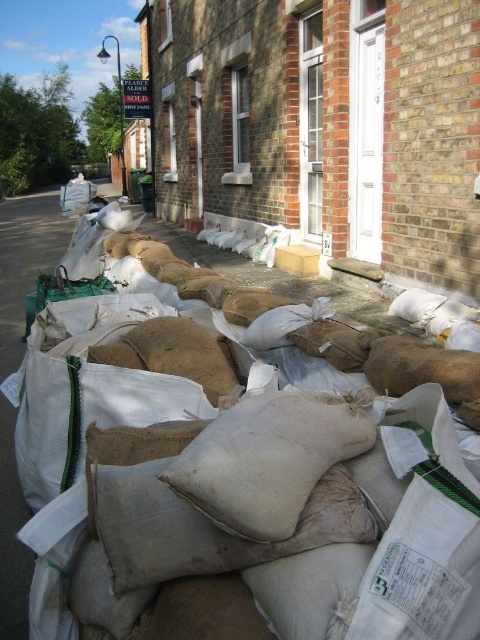
You are a delivery person trying to place a beige fabric pillow at center and a burlap sack at center onto a shelf. The shelf can only hold items that are not stacked. Can you place both items on the shelf?

The beige fabric pillow at center is positioned under burlap sack at center, so they are stacked. Therefore, you cannot place both items on the shelf since the shelf can only hold items that are not stacked.

You are a delivery person trying to navigate through the street scene. You see a beige fabric pillow at center and a burlap sack at center. Which object is narrower?

The beige fabric pillow at center is narrower than the burlap sack at center.